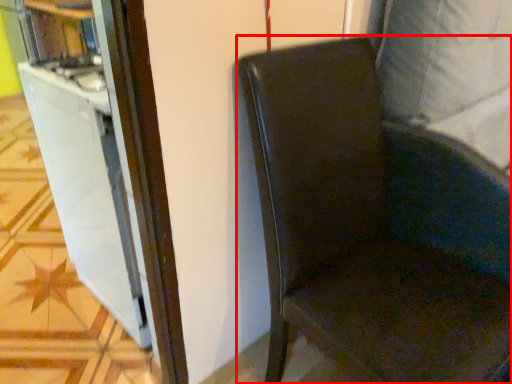
Question: From the image, what is the correct spatial relationship of chair (annotated by the red box) in relation to file cabinet?

Choices:
 (A) left
 (B) right

Answer: (B)